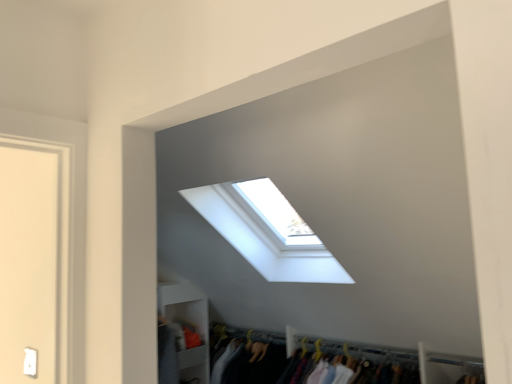
Identify the location of white matte shelf at lower left. (187, 325).

What do you see at coordinates (187, 325) in the screenshot? This screenshot has width=512, height=384. I see `white matte shelf at lower left` at bounding box center [187, 325].

Identify the location of transparent glass window at upper center. (262, 238).

This screenshot has width=512, height=384. Describe the element at coordinates (262, 238) in the screenshot. I see `transparent glass window at upper center` at that location.

Image resolution: width=512 pixels, height=384 pixels. I want to click on white matte shelf at lower left, so click(x=187, y=325).

Can you confirm if white matte shelf at lower left is positioned to the left of transparent glass window at upper center?

Correct, you'll find white matte shelf at lower left to the left of transparent glass window at upper center.

Relative to transparent glass window at upper center, is white matte shelf at lower left in front or behind?

white matte shelf at lower left is positioned farther from the viewer than transparent glass window at upper center.

Does point (179, 291) come in front of point (284, 250)?

No.

From the image's perspective, is white matte shelf at lower left below transparent glass window at upper center?

Correct, white matte shelf at lower left appears lower than transparent glass window at upper center in the image.

From a real-world perspective, which object stands above the other?

In real-world perspective, transparent glass window at upper center is above.

Considering the sizes of objects white matte shelf at lower left and transparent glass window at upper center in the image provided, who is wider, white matte shelf at lower left or transparent glass window at upper center?

transparent glass window at upper center.

Is white matte shelf at lower left shorter than transparent glass window at upper center?

No.

Is white matte shelf at lower left bigger or smaller than transparent glass window at upper center?

In the image, white matte shelf at lower left appears to be smaller than transparent glass window at upper center.

Does white matte shelf at lower left contain transparent glass window at upper center?

No.

Does white matte shelf at lower left touch transparent glass window at upper center?

No, white matte shelf at lower left is not next to transparent glass window at upper center.

Based on the photo, is white matte shelf at lower left oriented towards transparent glass window at upper center?

Yes.

In the image, there is a transparent glass window at upper center. What are the coordinates of `shelf below it (from the image's perspective)` in the screenshot? It's located at 187,325.

Based on the photo, considering the relative positions of transparent glass window at upper center and white matte shelf at lower left in the image provided, is transparent glass window at upper center to the left or to the right of white matte shelf at lower left?

Based on their positions, transparent glass window at upper center is located to the right of white matte shelf at lower left.

Is transparent glass window at upper center further to camera compared to white matte shelf at lower left?

No, transparent glass window at upper center is closer to the camera.

Between point (238, 239) and point (207, 322), which one is positioned in front?

The point (238, 239) is in front.

From the image's perspective, relative to white matte shelf at lower left, is transparent glass window at upper center above or below?

Clearly, from the image's perspective, transparent glass window at upper center is above white matte shelf at lower left.

From a real-world perspective, is transparent glass window at upper center located higher than white matte shelf at lower left?

Yes.

Which object is thinner, transparent glass window at upper center or white matte shelf at lower left?

Thinner between the two is white matte shelf at lower left.

Who is taller, transparent glass window at upper center or white matte shelf at lower left?

With more height is white matte shelf at lower left.

Between transparent glass window at upper center and white matte shelf at lower left, which one has smaller size?

white matte shelf at lower left is smaller.

Looking at this image, choose the correct answer: Is transparent glass window at upper center inside white matte shelf at lower left or outside it?

transparent glass window at upper center is spatially situated outside white matte shelf at lower left.

Are transparent glass window at upper center and white matte shelf at lower left located far from each other?

Actually, transparent glass window at upper center and white matte shelf at lower left are a little close together.

Is white matte shelf at lower left at the back of transparent glass window at upper center?

No, transparent glass window at upper center's orientation is not away from white matte shelf at lower left.

Find the location of a particular element. This screenshot has height=384, width=512. window above the white matte shelf at lower left (from a real-world perspective) is located at coordinates (262, 238).

At what (x,y) coordinates should I click in order to perform the action: click on window above the white matte shelf at lower left (from a real-world perspective). Please return your answer as a coordinate pair (x, y). Looking at the image, I should click on (262, 238).

The image size is (512, 384). Identify the location of window in front of the white matte shelf at lower left. (262, 238).